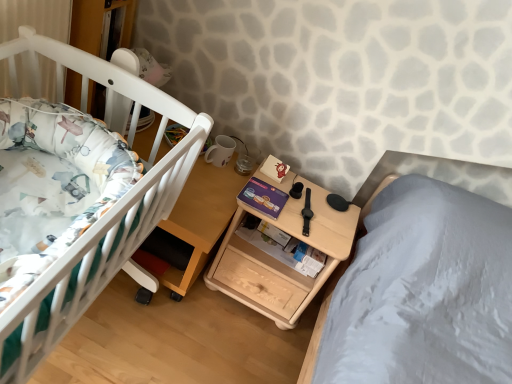
The width and height of the screenshot is (512, 384). I want to click on wooden bookshelf at upper left, so click(102, 26).

In order to click on white matte crib at left in this screenshot , I will do `click(92, 205)`.

What is the approximate width of natural wood nightstand at center?

13.72 inches.

Identify the location of wooden bookshelf at upper left. (102, 26).

Based on the photo, considering the positions of objects white matte crib at left and wooden table at left in the image provided, who is behind, white matte crib at left or wooden table at left?

wooden table at left is more distant.

Measure the distance between white matte crib at left and wooden table at left.

white matte crib at left and wooden table at left are 13.21 inches apart from each other.

Between point (30, 314) and point (147, 295), which one is positioned in front?

The point (30, 314) is closer to the camera.

In the scene shown: Can you confirm if white matte crib at left is bigger than wooden table at left?

Incorrect, white matte crib at left is not larger than wooden table at left.

How many degrees apart are the facing directions of natural wood nightstand at center and white matte crib at left?

The facing directions of natural wood nightstand at center and white matte crib at left are 90.7 degrees apart.

Can you see natural wood nightstand at center touching white matte crib at left?

No, natural wood nightstand at center is not next to white matte crib at left.

At what (x,y) coordinates should I click in order to perform the action: click on infant bed above the natural wood nightstand at center (from the image's perspective). Please return your answer as a coordinate pair (x, y). Looking at the image, I should click on (92, 205).

From the picture: From a real-world perspective, is natural wood nightstand at center physically located above or below white matte crib at left?

From a real-world perspective, natural wood nightstand at center is physically below white matte crib at left.

Considering the sizes of objects wooden table at left and natural wood nightstand at center in the image provided, who is wider, wooden table at left or natural wood nightstand at center?

With larger width is wooden table at left.

Considering the relative positions of wooden table at left and natural wood nightstand at center in the image provided, is wooden table at left to the left of natural wood nightstand at center from the viewer's perspective?

Indeed, wooden table at left is positioned on the left side of natural wood nightstand at center.

Which object is closer to the camera, wooden table at left or natural wood nightstand at center?

wooden table at left is more forward.

Is point (141, 298) positioned behind point (281, 327)?

No, it is in front of (281, 327).

Is wooden bookshelf at upper left surrounding white matte crib at left?

No, white matte crib at left is not inside wooden bookshelf at upper left.

Considering the sizes of objects wooden bookshelf at upper left and white matte crib at left in the image provided, who is thinner, wooden bookshelf at upper left or white matte crib at left?

wooden bookshelf at upper left is thinner.

From the image's perspective, which is below, wooden bookshelf at upper left or white matte crib at left?

white matte crib at left, from the image's perspective.

How many degrees apart are the facing directions of natural wood nightstand at center and wooden bookshelf at upper left?

natural wood nightstand at center and wooden bookshelf at upper left are facing 85.9 degrees away from each other.

Considering the relative sizes of natural wood nightstand at center and wooden bookshelf at upper left in the image provided, is natural wood nightstand at center taller than wooden bookshelf at upper left?

Correct, natural wood nightstand at center is much taller as wooden bookshelf at upper left.

From the picture: Considering the sizes of objects natural wood nightstand at center and wooden bookshelf at upper left in the image provided, who is thinner, natural wood nightstand at center or wooden bookshelf at upper left?

wooden bookshelf at upper left is thinner.

At what (x,y) coordinates should I click in order to perform the action: click on nightstand located in front of the wooden bookshelf at upper left. Please return your answer as a coordinate pair (x, y). Image resolution: width=512 pixels, height=384 pixels. Looking at the image, I should click on (278, 260).

From a real-world perspective, who is located lower, wooden table at left or wooden bookshelf at upper left?

In real-world perspective, wooden table at left is lower.

Which is more distant, (191,244) or (125,27)?

The point (125,27) is more distant.

Find the location of `table below the wooden bookshelf at upper left (from the image's perspective)`. table below the wooden bookshelf at upper left (from the image's perspective) is located at coordinates (192, 227).

Between wooden table at left and wooden bookshelf at upper left, which one has larger size?

With larger size is wooden table at left.

Is wooden bookshelf at upper left looking in the opposite direction of natural wood nightstand at center?

No, wooden bookshelf at upper left is not facing the opposite direction of natural wood nightstand at center.

Is wooden bookshelf at upper left behind natural wood nightstand at center?

Yes.

Considering the relative sizes of wooden bookshelf at upper left and natural wood nightstand at center in the image provided, is wooden bookshelf at upper left taller than natural wood nightstand at center?

No.

Locate an element on the screen. Image resolution: width=512 pixels, height=384 pixels. infant bed above the wooden table at left (from the image's perspective) is located at coordinates (92, 205).

Locate an element on the screen. nightstand located underneath the white matte crib at left (from a real-world perspective) is located at coordinates (278, 260).

Estimate the real-world distances between objects in this image. Which object is further from white matte crib at left, wooden table at left or natural wood nightstand at center?

natural wood nightstand at center is positioned further to the anchor white matte crib at left.

From the image, which object appears to be nearer to wooden bookshelf at upper left, wooden table at left or white matte crib at left?

The object closer to wooden bookshelf at upper left is white matte crib at left.

Considering their positions, is wooden table at left positioned closer to white matte crib at left than wooden bookshelf at upper left?

wooden table at left is positioned closer to the anchor white matte crib at left.

From the image, which object appears to be nearer to wooden table at left, wooden bookshelf at upper left or natural wood nightstand at center?

Based on the image, natural wood nightstand at center appears to be nearer to wooden table at left.

Looking at the image, which one is located closer to wooden table at left, wooden bookshelf at upper left or white matte crib at left?

white matte crib at left is closer to wooden table at left.

Looking at the image, which one is located closer to white matte crib at left, natural wood nightstand at center or wooden bookshelf at upper left?

wooden bookshelf at upper left is closer to white matte crib at left.

When comparing their distances from natural wood nightstand at center, does wooden bookshelf at upper left or wooden table at left seem further?

wooden bookshelf at upper left is positioned further to the anchor natural wood nightstand at center.

Looking at the image, which one is located further to white matte crib at left, natural wood nightstand at center or wooden table at left?

natural wood nightstand at center.

This screenshot has width=512, height=384. I want to click on table between white matte crib at left and natural wood nightstand at center along the z-axis, so click(x=192, y=227).

The width and height of the screenshot is (512, 384). Find the location of `table between white matte crib at left and wooden bookshelf at upper left along the z-axis`. table between white matte crib at left and wooden bookshelf at upper left along the z-axis is located at coordinates (192, 227).

Find the location of a particular element. nightstand between white matte crib at left and wooden bookshelf at upper left from front to back is located at coordinates point(278,260).

Identify the location of table that lies between wooden bookshelf at upper left and natural wood nightstand at center from top to bottom. Image resolution: width=512 pixels, height=384 pixels. pos(192,227).